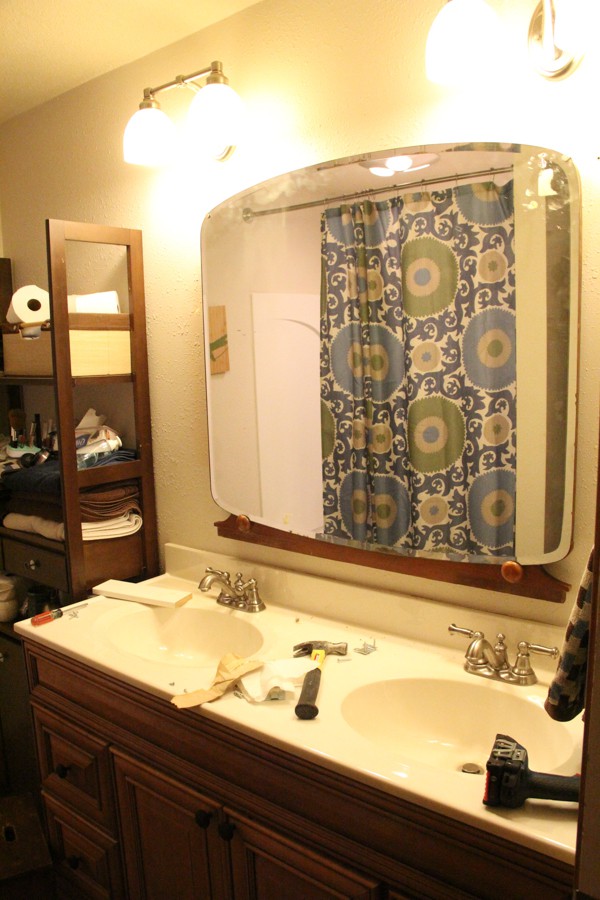
At what (x,y) coordinates should I click in order to perform the action: click on faucets. Please return your answer as a coordinate pair (x, y). This screenshot has width=600, height=900. Looking at the image, I should click on [x=469, y=654], [x=211, y=582].